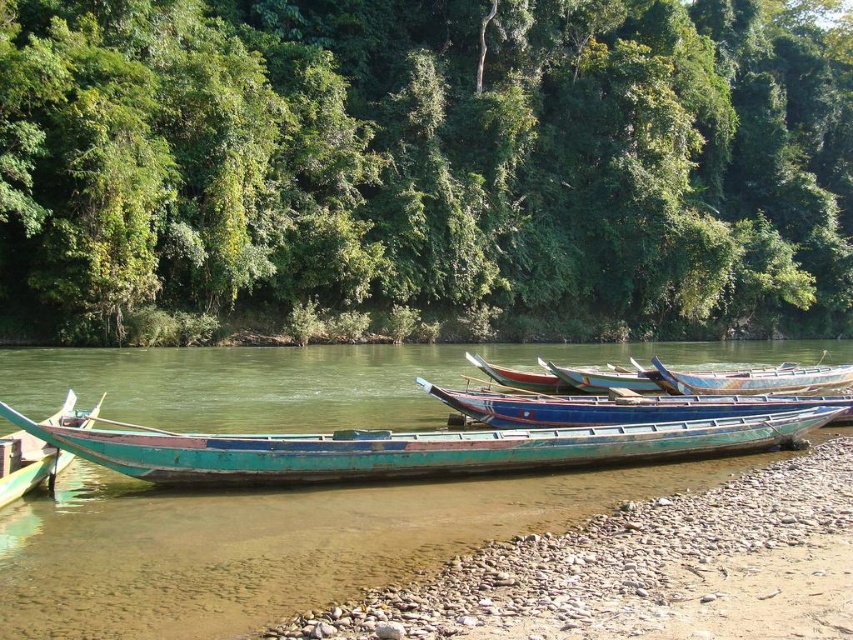
You are standing at the riverside and want to take a photo of the green leafy trees at upper center and the green wood shoreline at lower left. Which object should you focus on first to ensure both are in the frame?

You should focus on the green leafy trees at upper center first because it is closer to you than the green wood shoreline at lower left, ensuring both are in the frame.

You are an environmental scientist assessing the riverbank stability. You observe the green wood shoreline at lower left and the blue painted wood canoe at center. Which object is shorter in height?

The green wood shoreline at lower left is shorter in height compared to the blue painted wood canoe at center.